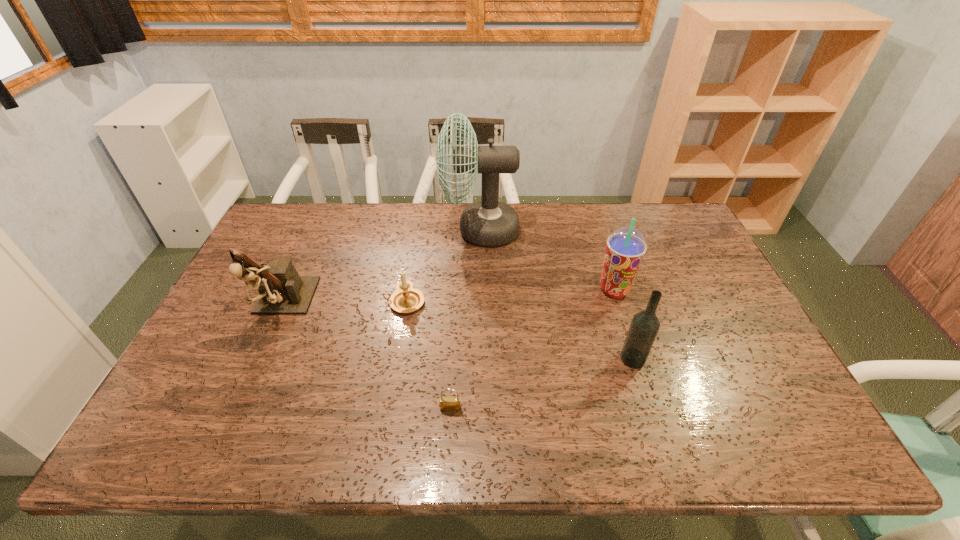
In order to click on free spot that satisfies the following two spatial constraints: 1. in front of the fifth farthest object where the airflow is directed; 2. on the right side of the farthest object in this screenshot , I will do `click(480, 359)`.

The height and width of the screenshot is (540, 960). What are the coordinates of `free space that satisfies the following two spatial constraints: 1. on the back side of the second nearest object; 2. in front of the tallest object where the airflow is directed` in the screenshot? It's located at (593, 230).

You are a GUI agent. You are given a task and a screenshot of the screen. Output one action in this format:
    pyautogui.click(x=<x>, y=<y>)
    Task: Click on the free space that satisfies the following two spatial constraints: 1. with a handle on the side of the candle holder; 2. on the front-facing side of the leftmost object
    This screenshot has width=960, height=540.
    Given the screenshot: What is the action you would take?
    pyautogui.click(x=403, y=307)

Where is `vacant point that satisfies the following two spatial constraints: 1. in front of the tallest object where the airflow is directed; 2. on the front-facing side of the nearest object`? This screenshot has width=960, height=540. vacant point that satisfies the following two spatial constraints: 1. in front of the tallest object where the airflow is directed; 2. on the front-facing side of the nearest object is located at coordinates (480, 409).

What are the coordinates of `free location that satisfies the following two spatial constraints: 1. on the back side of the fifth farthest object; 2. in front of the tallest object where the airflow is directed` in the screenshot? It's located at (593, 230).

At what (x,y) coordinates should I click in order to perform the action: click on vacant space that satisfies the following two spatial constraints: 1. in front of the fan where the airflow is directed; 2. on the front-facing side of the figurine. Please return your answer as a coordinate pair (x, y). Image resolution: width=960 pixels, height=540 pixels. Looking at the image, I should click on (480, 307).

The width and height of the screenshot is (960, 540). Identify the location of free location that satisfies the following two spatial constraints: 1. on the front-facing side of the leftmost object; 2. on the right side of the fifth farthest object. (259, 359).